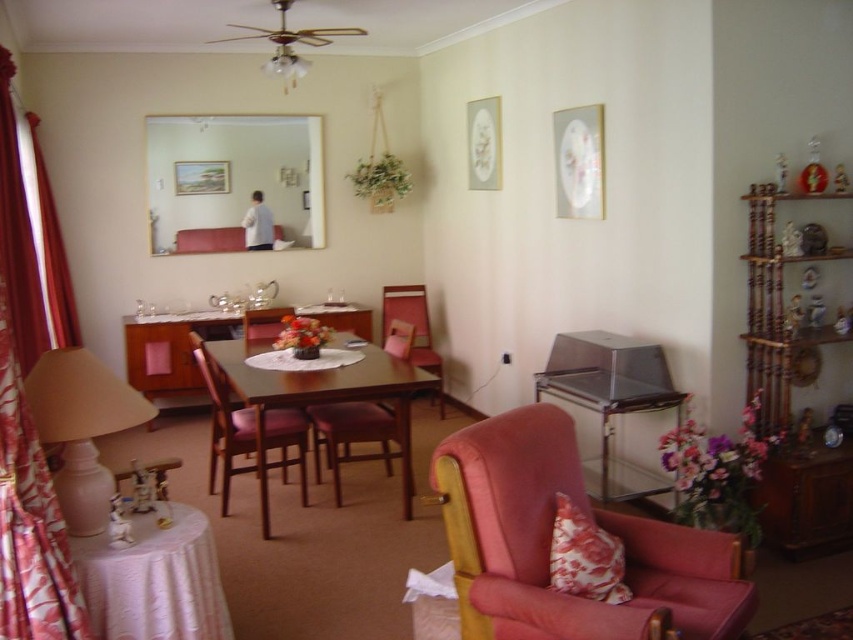
Is white lace tablecloth at lower left thinner than mahogany wooden table at center?

Yes.

Identify the location of white lace tablecloth at lower left. Image resolution: width=853 pixels, height=640 pixels. (154, 579).

Is point (218, 573) more distant than point (367, 348)?

No, (218, 573) is closer to viewer.

Where is `white lace tablecloth at lower left`? white lace tablecloth at lower left is located at coordinates (154, 579).

Which is above, wooden table at center or white glass chandelier at upper center?

white glass chandelier at upper center is higher up.

The width and height of the screenshot is (853, 640). I want to click on wooden table at center, so click(186, 348).

Does point (207, 557) come closer to viewer compared to point (368, 330)?

Yes, point (207, 557) is in front of point (368, 330).

Is point (163, 508) farther from viewer compared to point (144, 356)?

No.

What do you see at coordinates (154, 579) in the screenshot? I see `white lace tablecloth at lower left` at bounding box center [154, 579].

Identify the location of white lace tablecloth at lower left. This screenshot has height=640, width=853. (154, 579).